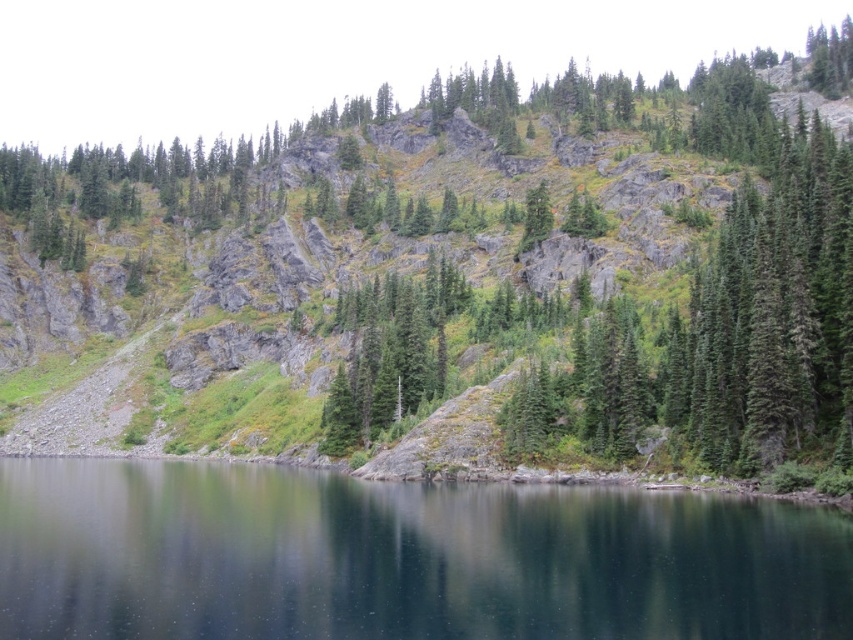
You are standing at the edge of the dark blue water at center and want to reach the green grassy hillside at center. Which direction should you walk to get there?

You should walk to the right because the green grassy hillside at center is located to the right of the dark blue water at center.

You are planning to build a small wooden bridge connecting the green grassy hillside at center and dark blue water at center. What is the minimum length of the bridge required to span the gap between them?

The minimum length of the bridge required to span the gap between the green grassy hillside at center and dark blue water at center is 65.79 meters.